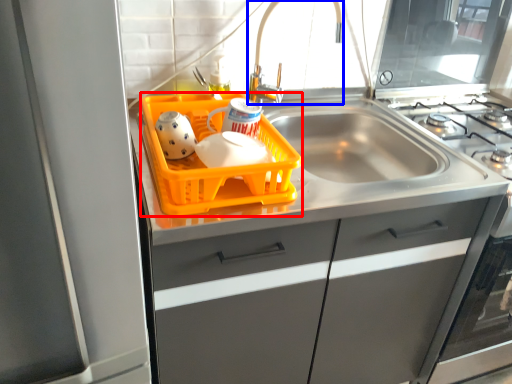
Question: Among these objects, which one is nearest to the camera, basket (highlighted by a red box) or faucet (highlighted by a blue box)?

Choices:
 (A) basket
 (B) faucet

Answer: (A)